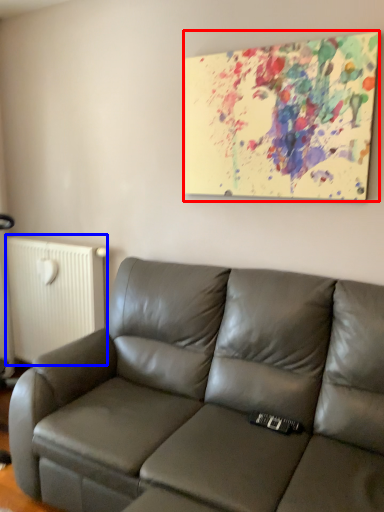
Question: Among these objects, which one is nearest to the camera, picture frame (highlighted by a red box) or radiator (highlighted by a blue box)?

Choices:
 (A) picture frame
 (B) radiator

Answer: (A)